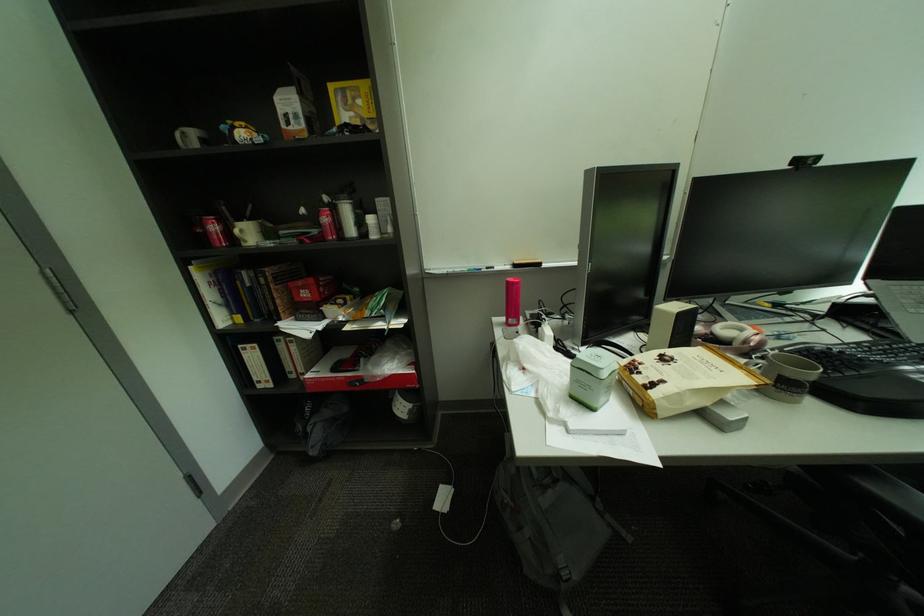
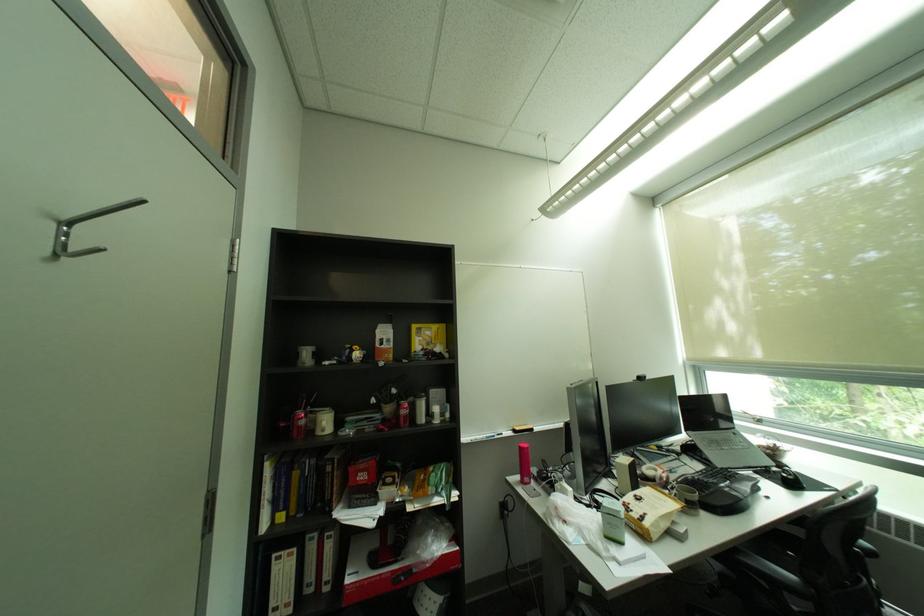
Where in the second image is the point corresponding to (x=210, y=232) from the first image?

(293, 426)